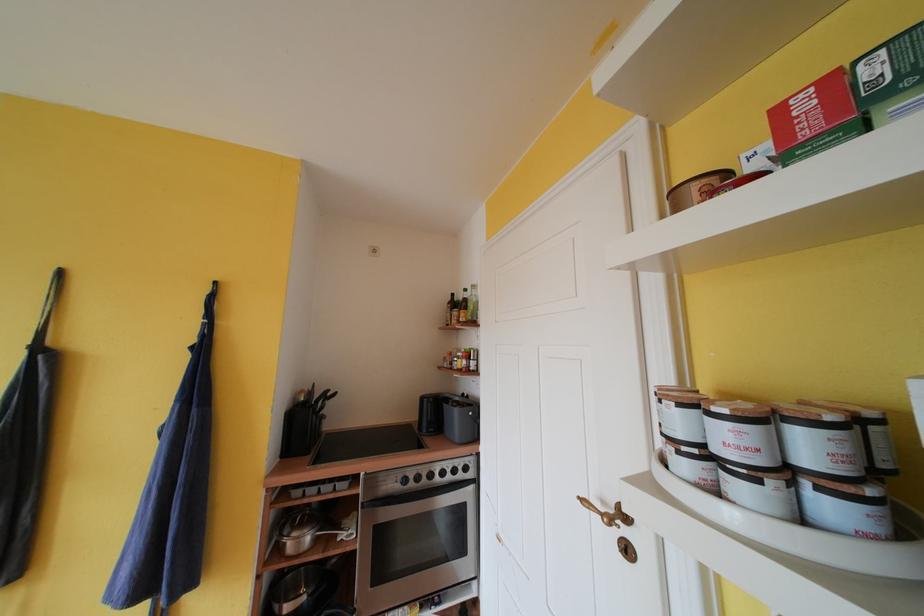
Where is `pot handle`? Image resolution: width=924 pixels, height=616 pixels. pot handle is located at coordinates (293, 531).